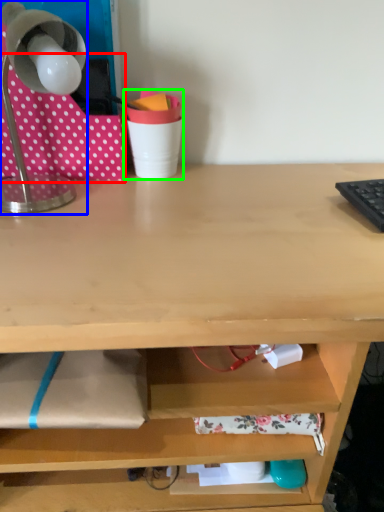
Question: Which object is positioned farthest from fabric (highlighted by a red box)? Select from lamp (highlighted by a blue box) and stationery (highlighted by a green box).

Choices:
 (A) lamp
 (B) stationery

Answer: (B)